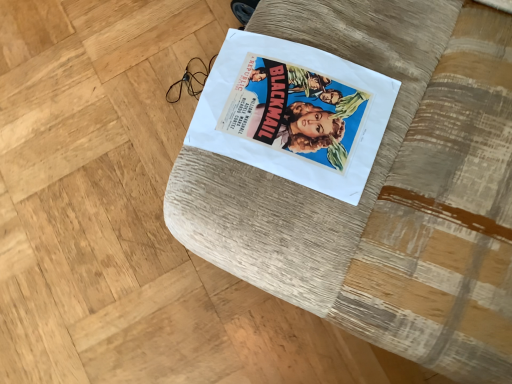
Question: Does textured fabric cushion at center have a smaller size compared to white paper at center?

Choices:
 (A) no
 (B) yes

Answer: (A)

Question: Considering the relative positions of textured fabric cushion at center and white paper at center in the image provided, is textured fabric cushion at center behind white paper at center?

Choices:
 (A) no
 (B) yes

Answer: (A)

Question: Is textured fabric cushion at center facing towards white paper at center?

Choices:
 (A) no
 (B) yes

Answer: (B)

Question: Is the position of textured fabric cushion at center less distant than that of white paper at center?

Choices:
 (A) no
 (B) yes

Answer: (B)

Question: Is textured fabric cushion at center wider than white paper at center?

Choices:
 (A) yes
 (B) no

Answer: (A)

Question: Is textured fabric cushion at center to the right of white paper at center from the viewer's perspective?

Choices:
 (A) yes
 (B) no

Answer: (A)

Question: From the image's perspective, is white paper at center over textured fabric cushion at center?

Choices:
 (A) no
 (B) yes

Answer: (B)

Question: Is the position of white paper at center more distant than that of textured fabric cushion at center?

Choices:
 (A) no
 (B) yes

Answer: (B)

Question: From the image's perspective, would you say white paper at center is shown under textured fabric cushion at center?

Choices:
 (A) no
 (B) yes

Answer: (A)

Question: Is white paper at center in contact with textured fabric cushion at center?

Choices:
 (A) yes
 (B) no

Answer: (A)

Question: Does white paper at center lie in front of textured fabric cushion at center?

Choices:
 (A) no
 (B) yes

Answer: (A)

Question: Does white paper at center have a lesser height compared to textured fabric cushion at center?

Choices:
 (A) no
 (B) yes

Answer: (B)

Question: Considering the positions of white paper at center and textured fabric cushion at center in the image, is white paper at center taller or shorter than textured fabric cushion at center?

Choices:
 (A) tall
 (B) short

Answer: (B)